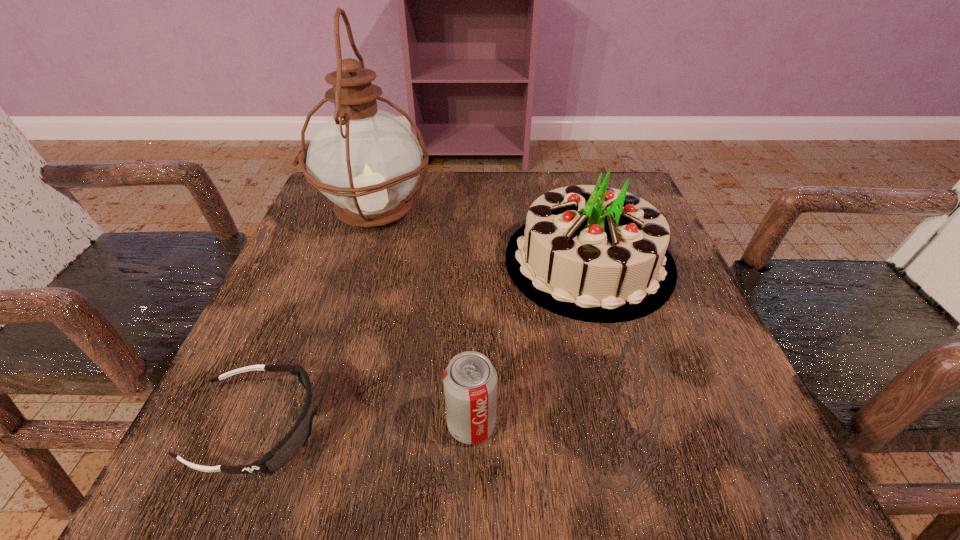
Locate an element on the screen. This screenshot has height=540, width=960. vacant area that satisfies the following two spatial constraints: 1. on the back side of the rightmost object; 2. on the right side of the second shortest object is located at coordinates (474, 261).